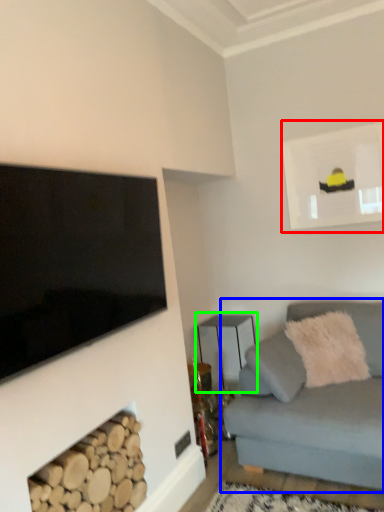
Question: Considering the real-world distances, which object is farthest from picture frame (highlighted by a red box)? studio couch (highlighted by a blue box) or table (highlighted by a green box)?

Choices:
 (A) studio couch
 (B) table

Answer: (A)